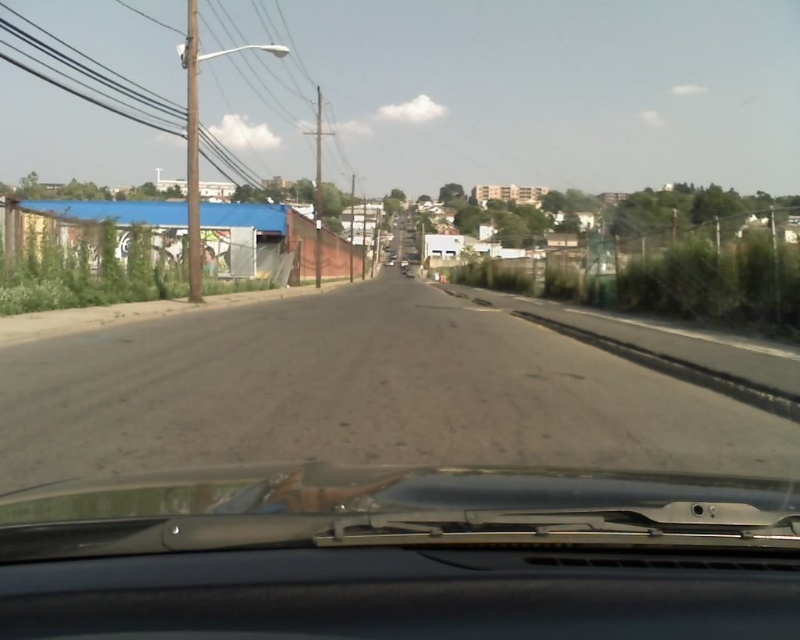
You are a passenger in the car and want to estimate how far the black rubber windshield wiper at lower center is from your seat. Based on the scene, can you determine the distance?

The black rubber windshield wiper at lower center is 3.35 meters away from the viewer, so the distance from your seat to the black rubber windshield wiper at lower center is approximately 3.35 meters.

You are driving a car and want to turn left onto the dirt track at lower left from the current road. Given that your car has a turning radius of 18 feet, can you make the turn without hitting the black rubber windshield wiper at lower center?

The distance between the black rubber windshield wiper at lower center and the dirt track at lower left is 22.85 feet. Since the car has a turning radius of 18 feet, which is smaller than the available distance, you can make the turn without hitting the windshield wiper.

You are sitting in the driver seat of the car and want to know if the point at coordinate (x=666, y=528) is closer to you than the point at (x=324, y=397). Can you confirm this based on the scene?

Yes, the point at coordinate (x=666, y=528) is closer to the camera than the point at (x=324, y=397).